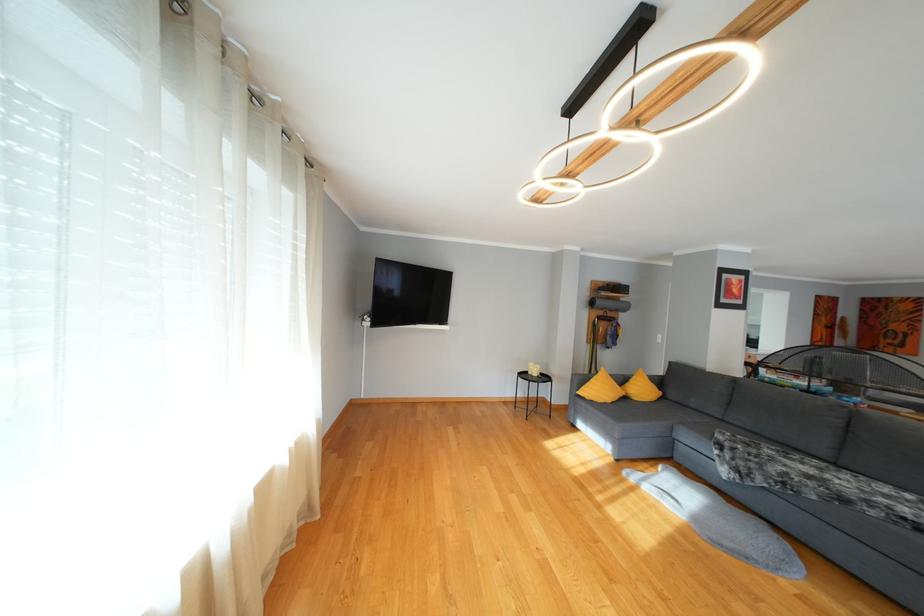
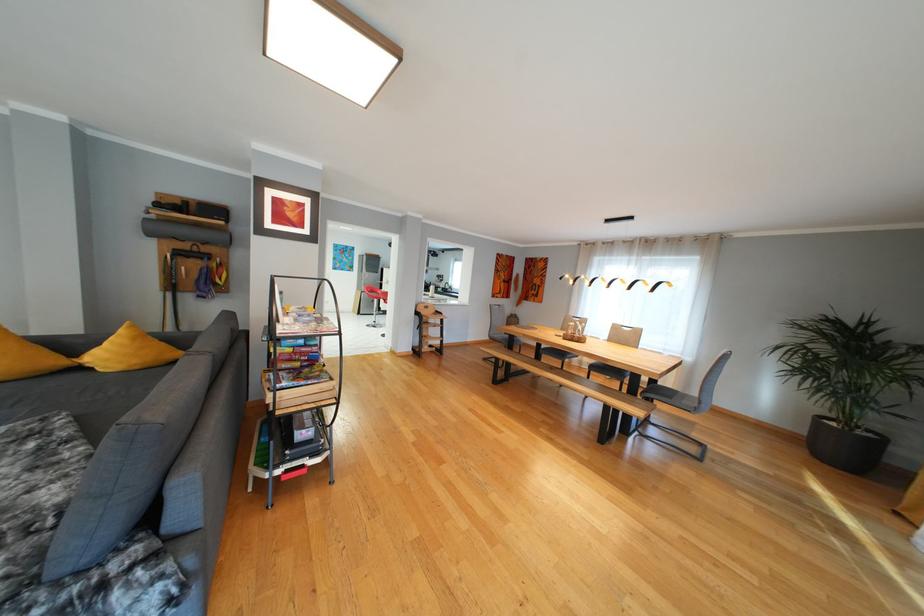
Question: The images are taken continuously from a first-person perspective. In which direction are you moving?

Choices:
 (A) Left
 (B) Right
 (C) Forward
 (D) Backward

Answer: (B)